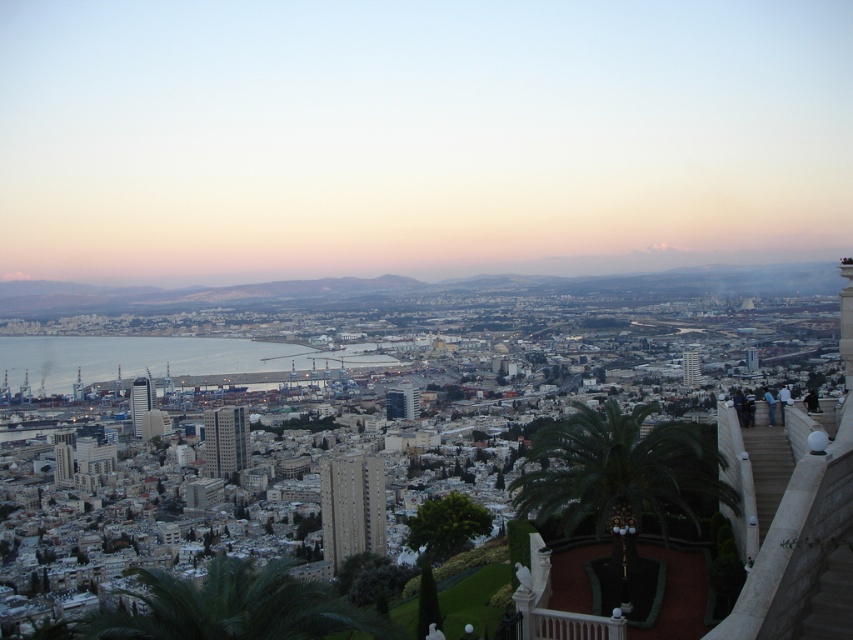
Which is behind, point (265, 637) or point (277, 346)?

Point (277, 346)

Find the location of `green leafy palm tree at lower center`. green leafy palm tree at lower center is located at coordinates (233, 608).

Is point (552, 493) farther from viewer compared to point (241, 348)?

No, (552, 493) is closer to viewer.

Between green leafy palm at center and blue water at center, which one has less height?

Standing shorter between the two is blue water at center.

Between point (596, 460) and point (85, 356), which one is positioned in front?

Point (596, 460)

Where is `green leafy palm at center`? The image size is (853, 640). green leafy palm at center is located at coordinates (619, 470).

Which of these two, green leafy palm at center or green leafy palm tree at lower center, stands taller?

green leafy palm at center is taller.

Which is behind, point (692, 502) or point (271, 611)?

Positioned behind is point (692, 502).

Which is behind, point (618, 548) or point (78, 627)?

Positioned behind is point (618, 548).

The width and height of the screenshot is (853, 640). I want to click on green leafy palm at center, so click(619, 470).